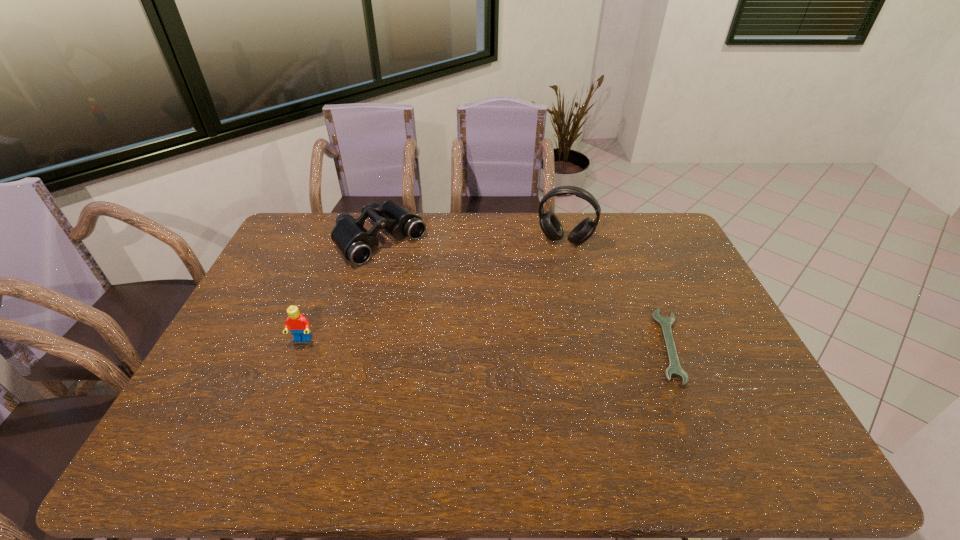
Identify the location of vacant space located on the front-facing side of the binoculars. This screenshot has width=960, height=540. [x=480, y=328].

The image size is (960, 540). Find the location of `vacant space located on the earcups of the headset`. vacant space located on the earcups of the headset is located at coordinates (538, 314).

In order to click on free region located on the earcups of the headset in this screenshot , I will do `click(553, 266)`.

The height and width of the screenshot is (540, 960). Find the location of `vacant position located 0.110m on the earcups of the headset`. vacant position located 0.110m on the earcups of the headset is located at coordinates (552, 269).

The height and width of the screenshot is (540, 960). What are the coordinates of `binoculars at the far edge` in the screenshot? It's located at (356, 243).

The image size is (960, 540). Identify the location of headset located at the far edge. (549, 223).

Find the location of a particular element. object at the right edge is located at coordinates (674, 369).

This screenshot has width=960, height=540. In the image, there is a desktop. Find the location of `free region at the far edge`. free region at the far edge is located at coordinates (518, 225).

The width and height of the screenshot is (960, 540). In the image, there is a desktop. Find the location of `free space at the near edge`. free space at the near edge is located at coordinates click(699, 415).

Identify the location of vacant space at the left edge of the desktop. This screenshot has height=540, width=960. (280, 284).